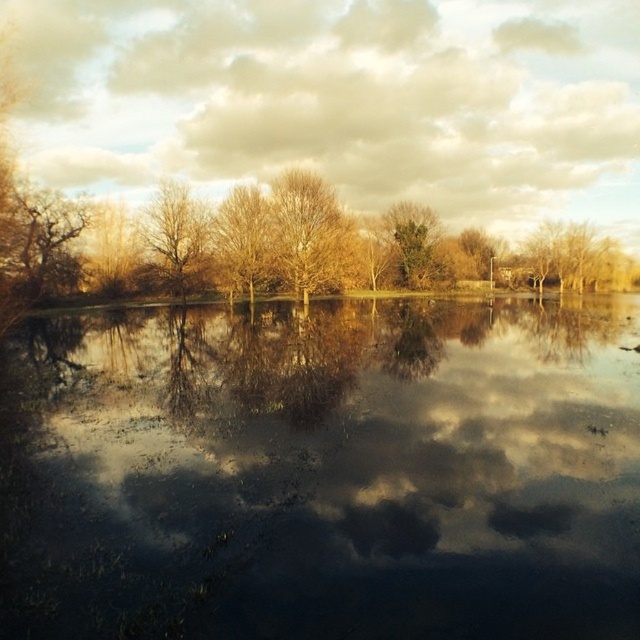
Question: Is golden textured tree at center to the left of green leafy tree at center from the viewer's perspective?

Choices:
 (A) yes
 (B) no

Answer: (A)

Question: Is black reflective water at center wider than brown textured tree at left?

Choices:
 (A) no
 (B) yes

Answer: (B)

Question: Considering the real-world distances, which object is closest to the cloudy sky at upper center?

Choices:
 (A) golden textured tree at center
 (B) brown textured tree at left
 (C) black reflective water at center
 (D) bare branches at center

Answer: (D)

Question: Among these objects, which one is nearest to the camera?

Choices:
 (A) bare branches at center
 (B) cloudy sky at upper center
 (C) brown textured tree at left

Answer: (C)

Question: Can you confirm if golden textured tree at center is thinner than brown leafless tree at center?

Choices:
 (A) no
 (B) yes

Answer: (A)

Question: Which of the following is the farthest from the observer?

Choices:
 (A) (412, 257)
 (B) (220, 214)

Answer: (A)